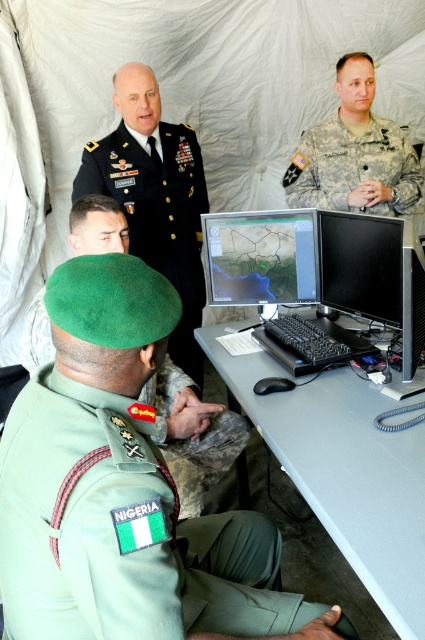
You are a military planner needing to place a new equipment box that measures 1.2 meters in length on the gray plastic table at center or the black glossy monitor at center. Based on their sizes, which object can accommodate the equipment box?

The gray plastic table at center has a larger size compared to the black glossy monitor at center, so the equipment box can be placed on the gray plastic table at center.

You are a military planner needing to set up a temporary command center. You have a gray plastic table at center and a green beret at center. Which object is higher in height?

The gray plastic table at center is much taller than the green beret at center.

You are a photographer trying to capture a clear shot of both the gray plastic table at center and the green beret at center. Since you can only focus on one object at a time, which object should you focus on first to ensure the other is still in focus?

The gray plastic table at center is closer to the viewer than the green beret at center, so focusing on the gray plastic table at center first would allow the green beret at center to remain in focus due to the depth of field.